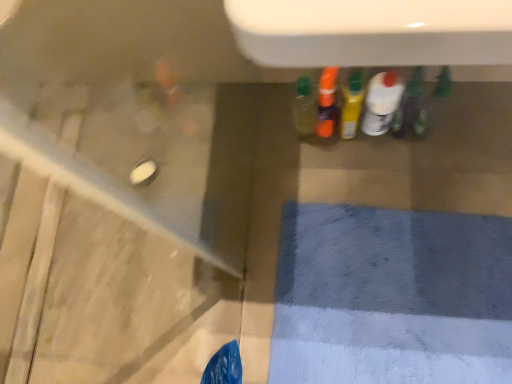
This screenshot has width=512, height=384. In order to click on vacant region to the left of translucent orange bottle at center, the 2th bottle when ordered from left to right in this screenshot , I will do `click(276, 149)`.